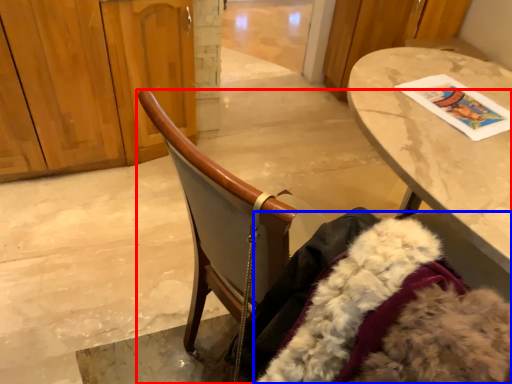
Question: Which object appears closest to the camera in this image, chair (highlighted by a red box) or fur coat (highlighted by a blue box)?

Choices:
 (A) chair
 (B) fur coat

Answer: (A)